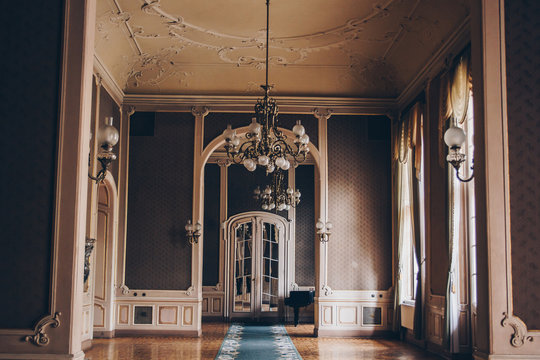
Locate an element on the screen. The height and width of the screenshot is (360, 540). white squares on bottom of walls is located at coordinates point(99,319), point(83,322), point(167,311), point(122,315), point(187,318), point(332,321), point(346,317).